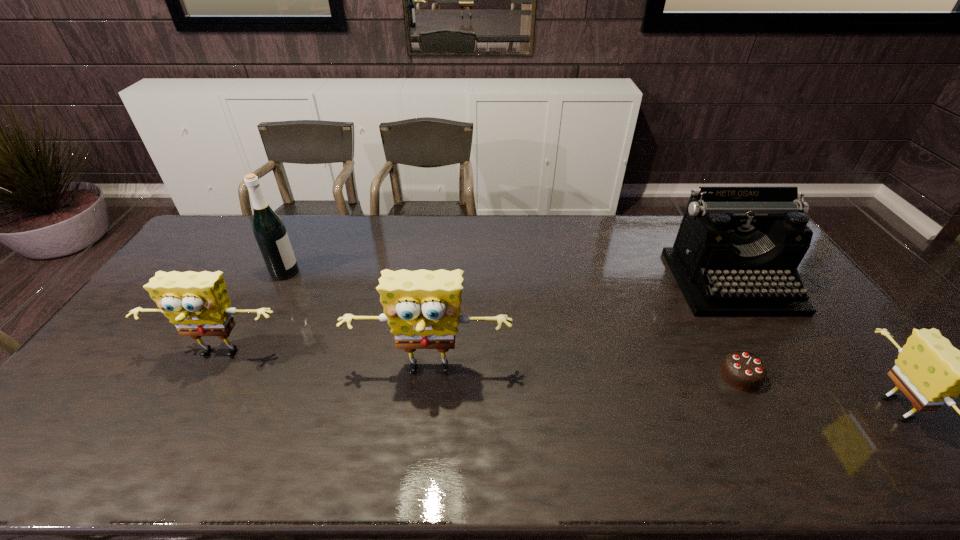
What are the coordinates of `object at the right edge` in the screenshot? It's located at (736, 253).

Where is `vacant space at the far edge of the desktop`? The height and width of the screenshot is (540, 960). vacant space at the far edge of the desktop is located at coordinates point(289,218).

Find the location of `vacant area at the near edge of the desktop`. vacant area at the near edge of the desktop is located at coordinates (446, 396).

At what (x,y) coordinates should I click in order to perform the action: click on vacant space at the far left corner of the desktop. Please return your answer as a coordinate pair (x, y). Looking at the image, I should click on (207, 247).

I want to click on vacant space in between the third object from left to right and the wine bottle, so click(357, 322).

You are a GUI agent. You are given a task and a screenshot of the screen. Output one action in this format:
    pyautogui.click(x=<x>, y=<y>)
    Task: Click on the unoccupied area between the wine bottle and the chocolate cake
    The width and height of the screenshot is (960, 540).
    Given the screenshot: What is the action you would take?
    pyautogui.click(x=513, y=323)

Where is `free space between the shortest object and the wine bottle`? This screenshot has height=540, width=960. free space between the shortest object and the wine bottle is located at coordinates (513, 323).

At what (x,y) coordinates should I click in order to perform the action: click on vacant space that is in between the leftmost sponge and the shortest object. Please return your answer as a coordinate pair (x, y). Image resolution: width=960 pixels, height=540 pixels. Looking at the image, I should click on (480, 366).

I want to click on vacant area that lies between the typewriter and the third object from left to right, so click(581, 327).

You are a GUI agent. You are given a task and a screenshot of the screen. Output one action in this format:
    pyautogui.click(x=<x>, y=<y>)
    Task: Click on the vacant area that lies between the chocolate cake and the typewriter
    The height and width of the screenshot is (540, 960).
    Given the screenshot: What is the action you would take?
    pyautogui.click(x=735, y=328)